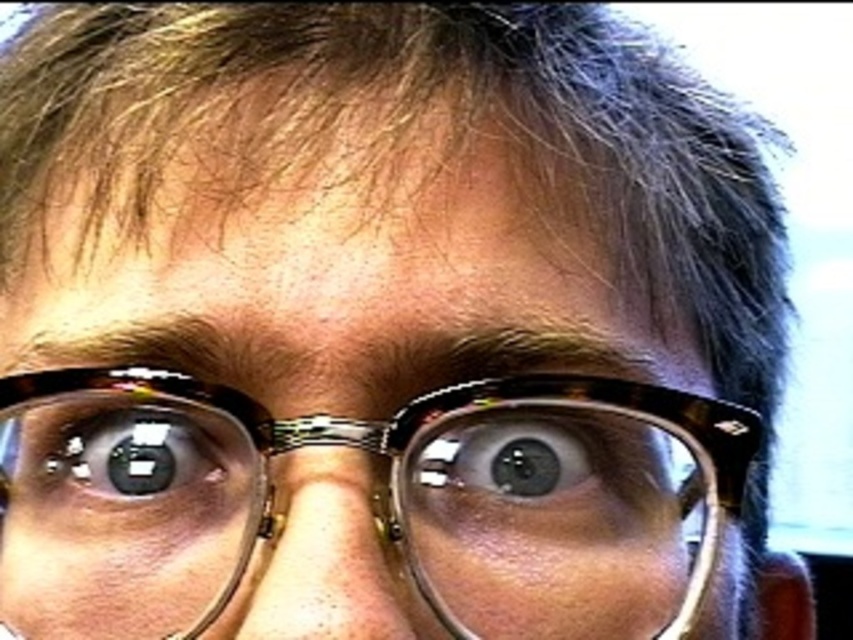
You are a photographer trying to capture a close portrait. You notice a point at coordinates point (x=370, y=563) on the subject. If your camera is 9.80 inches away from this point, will the subject be in focus? Assume the camera has a depth of field that can sharply focus objects within 10 inches of the camera.

The point (x=370, y=563) is 9.80 inches away from the camera, which is within the 10 inches depth of field. Therefore, the subject will be in focus.

You are a photographer adjusting the lighting for a portrait. You notice the matte plastic nose at center and the matte black eye at center in your frame. Which object should you adjust the light to highlight first if you want to ensure both are well lit, considering their positions?

The matte plastic nose at center is located below the matte black eye at center, so you should adjust the light to highlight the matte black eye at center first since it is higher and might require different lighting angles to avoid shadows from the nose.

You are a makeup artist preparing to apply eyeliner to the brown glossy eye at center. You need to ensure your tool doesn not accidentally touch the matte plastic nose at center. Given that the distance between them is 1.43 inches, is this distance sufficient to avoid contact if you work carefully?

The distance between the matte plastic nose at center and the brown glossy eye at center is 1.43 inches. This distance should be sufficient for careful application, as eyeliner tools typically require less than an inch of space to work precisely without touching nearby areas.